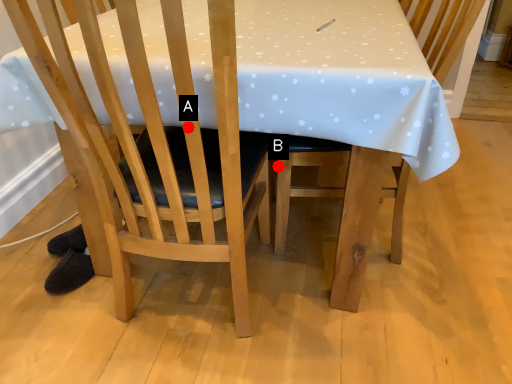
Question: Two points are circled on the image, labeled by A and B beside each circle. Which point is farther to the camera?

Choices:
 (A) A is further
 (B) B is further

Answer: (B)